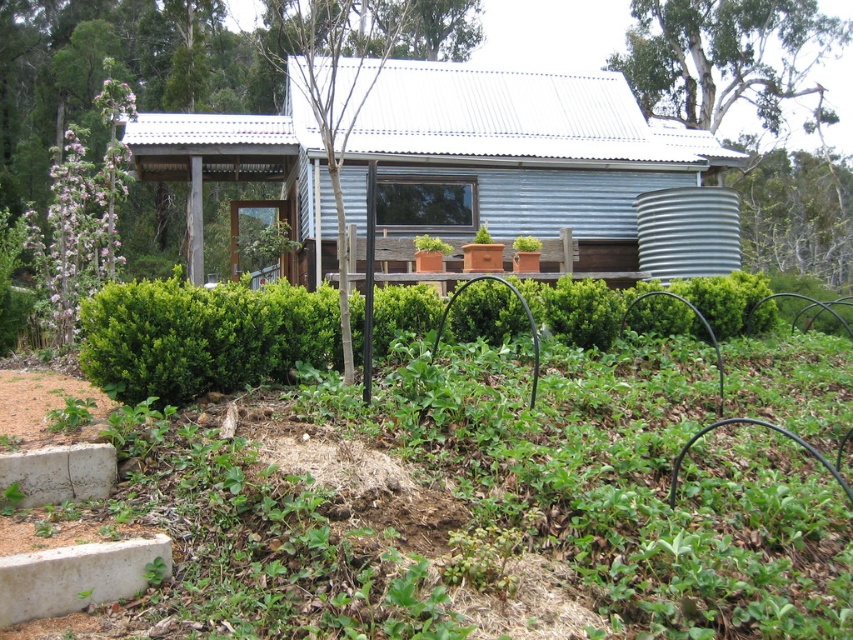
You are a gardener planning to trim the green leafy hedge at center and the white bark tree at upper right. Which of these two plants requires more effort to trim due to its thickness?

The white bark tree at upper right requires more effort to trim because it is thicker than the green leafy hedge at center.

You are planning to install a new sprinkler system in the garden. The sprinkler needs to cover both the green leafy hedge at center and the white bark tree at upper right. Considering their sizes, which area requires more water coverage?

The white bark tree at upper right requires more water coverage because it is larger than the green leafy hedge at center.

What object is located at the coordinates point (201, 337) in the image?

The point (201, 337) corresponds to the green leafy hedge at center.